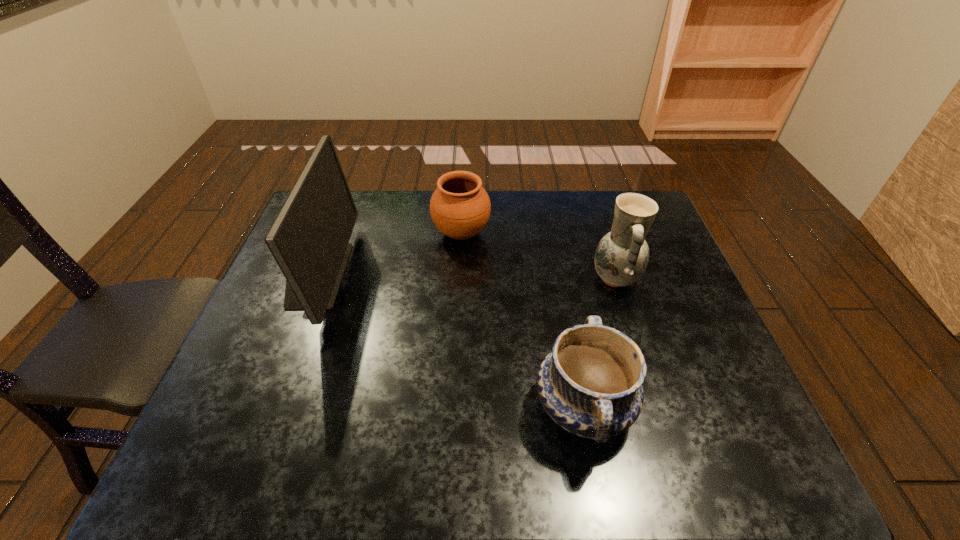
Find the location of a particular element. This screenshot has height=540, width=960. free space located on either side of the second nearest pottery is located at coordinates (565, 279).

At what (x,y) coordinates should I click in order to perform the action: click on free space located on the left of the third object from right to left. Please return your answer as a coordinate pair (x, y). The width and height of the screenshot is (960, 540). Looking at the image, I should click on (395, 233).

Where is `vacant region located on the left of the nearest object`? vacant region located on the left of the nearest object is located at coordinates (469, 407).

Locate an element on the screen. This screenshot has width=960, height=540. computer monitor that is at the far edge is located at coordinates pyautogui.click(x=309, y=239).

Image resolution: width=960 pixels, height=540 pixels. I want to click on pottery that is at the far edge, so click(460, 207).

Find the location of a particular element. object that is at the near edge is located at coordinates (590, 384).

You are a GUI agent. You are given a task and a screenshot of the screen. Output one action in this format:
    pyautogui.click(x=<x>, y=<y>)
    Task: Click on the object located at the left edge
    This screenshot has height=540, width=960.
    Given the screenshot: What is the action you would take?
    pyautogui.click(x=309, y=239)

Where is `object that is at the right edge`? object that is at the right edge is located at coordinates (622, 255).

The height and width of the screenshot is (540, 960). I want to click on object positioned at the far left corner, so click(309, 239).

Identify the location of vacant space at the far edge of the desktop. (372, 197).